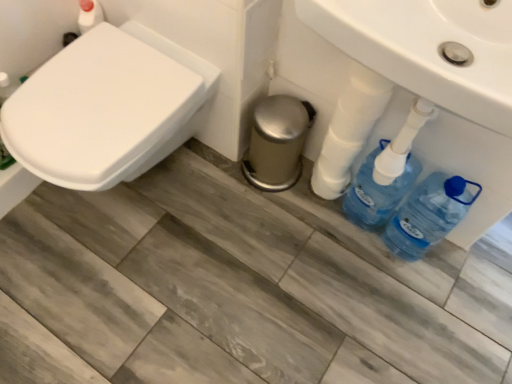
Where is `blue plastic bottle at lower right`? The height and width of the screenshot is (384, 512). blue plastic bottle at lower right is located at coordinates (428, 215).

Identify the location of white glossy sink at center. The width and height of the screenshot is (512, 384). (428, 49).

You are a GUI agent. You are given a task and a screenshot of the screen. Output one action in this format:
    pyautogui.click(x=<x>, y=<y>)
    Task: Click on the blue plastic bottle at lower right
    The height and width of the screenshot is (384, 512).
    Given the screenshot: What is the action you would take?
    pyautogui.click(x=428, y=215)

Are blue plastic bottle at lower right and white glossy toilet at left far apart?

They are positioned close to each other.

Is point (422, 220) closer or farther from the camera than point (77, 155)?

Point (422, 220) appears to be farther away from the viewer than point (77, 155).

Is white glossy toilet at left completely or partially inside blue plastic bottle at lower right?

No, white glossy toilet at left is not inside blue plastic bottle at lower right.

Can you tell me how much blue plastic bottle at lower right and white glossy toilet at left differ in facing direction?

The angle between the facing direction of blue plastic bottle at lower right and the facing direction of white glossy toilet at left is 1.95 degrees.

From the image's perspective, is blue plastic bottles at lower right below blue plastic bottle at lower right?

Incorrect, from the image's perspective, blue plastic bottles at lower right is higher than blue plastic bottle at lower right.

Is blue plastic bottle at lower right at the back of blue plastic bottles at lower right?

That's not correct — blue plastic bottles at lower right is not looking away from blue plastic bottle at lower right.

Which is closer, (361, 211) or (423, 244)?

Positioned in front is point (423, 244).

Can you confirm if blue plastic bottles at lower right is shorter than blue plastic bottle at lower right?

Incorrect, the height of blue plastic bottles at lower right does not fall short of that of blue plastic bottle at lower right.

How much distance is there between white glossy toilet at left and white glossy sink at center?

white glossy toilet at left is 23.96 inches from white glossy sink at center.

You are a GUI agent. You are given a task and a screenshot of the screen. Output one action in this format:
    pyautogui.click(x=<x>, y=<y>)
    Task: Click on the sink in front of the white glossy toilet at left
    The height and width of the screenshot is (384, 512).
    Given the screenshot: What is the action you would take?
    pyautogui.click(x=428, y=49)

Is white glossy toilet at left behind white glossy sink at center?

Yes, the depth of white glossy toilet at left is greater than that of white glossy sink at center.

Does white glossy toilet at left appear on the right side of white glossy sink at center?

In fact, white glossy toilet at left is to the left of white glossy sink at center.

Can you tell me how much blue plastic bottle at lower right and blue plastic bottles at lower right differ in facing direction?

blue plastic bottle at lower right and blue plastic bottles at lower right are facing 0.13 degrees away from each other.

Looking at this image, is blue plastic bottle at lower right oriented towards blue plastic bottles at lower right?

No.

Considering the sizes of blue plastic bottle at lower right and blue plastic bottles at lower right in the image, is blue plastic bottle at lower right wider or thinner than blue plastic bottles at lower right?

Clearly, blue plastic bottle at lower right has more width compared to blue plastic bottles at lower right.

Looking at this image, considering the sizes of objects blue plastic bottle at lower right and blue plastic bottles at lower right in the image provided, who is shorter, blue plastic bottle at lower right or blue plastic bottles at lower right?

blue plastic bottle at lower right is shorter.

Who is bigger, blue plastic bottles at lower right or white glossy toilet at left?

Bigger between the two is white glossy toilet at left.

Is blue plastic bottles at lower right further to camera compared to white glossy toilet at left?

Yes, blue plastic bottles at lower right is further from the viewer.

Is point (377, 217) in front of point (12, 125)?

No, (377, 217) is behind (12, 125).

Does blue plastic bottles at lower right touch white glossy toilet at left?

blue plastic bottles at lower right and white glossy toilet at left are clearly separated.

Are blue plastic bottle at lower right and white glossy sink at center beside each other?

blue plastic bottle at lower right and white glossy sink at center are not in contact.

Which point is more forward, (431, 232) or (432, 27)?

The point (432, 27) is closer.

From a real-world perspective, is blue plastic bottle at lower right located higher than white glossy sink at center?

No, from a real-world perspective, blue plastic bottle at lower right is not on top of white glossy sink at center.

Considering the positions of objects blue plastic bottle at lower right and white glossy sink at center in the image provided, who is more to the left, blue plastic bottle at lower right or white glossy sink at center?

Positioned to the left is white glossy sink at center.

Is white glossy toilet at left oriented away from blue plastic bottle at lower right?

white glossy toilet at left does not have its back to blue plastic bottle at lower right.

From a real-world perspective, which is physically above, white glossy toilet at left or blue plastic bottle at lower right?

From a 3D spatial view, white glossy toilet at left is above.

Is the surface of white glossy toilet at left in direct contact with blue plastic bottle at lower right?

No, white glossy toilet at left is not in contact with blue plastic bottle at lower right.

The image size is (512, 384). I want to click on bottle behind the white glossy toilet at left, so click(x=428, y=215).

I want to click on bottle above the blue plastic bottles at lower right (from a real-world perspective), so click(x=428, y=215).

Looking at the image, which one is located further to white glossy toilet at left, white glossy sink at center or blue plastic bottles at lower right?

blue plastic bottles at lower right is further to white glossy toilet at left.

When comparing their distances from blue plastic bottles at lower right, does white glossy toilet at left or white glossy sink at center seem closer?

white glossy sink at center lies closer to blue plastic bottles at lower right than the other object.

Estimate the real-world distances between objects in this image. Which object is closer to white glossy sink at center, blue plastic bottles at lower right or blue plastic bottle at lower right?

Based on the image, blue plastic bottles at lower right appears to be nearer to white glossy sink at center.

Based on their spatial positions, is blue plastic bottles at lower right or blue plastic bottle at lower right further from white glossy toilet at left?

blue plastic bottle at lower right is positioned further to the anchor white glossy toilet at left.

When comparing their distances from blue plastic bottle at lower right, does blue plastic bottles at lower right or white glossy sink at center seem closer?

blue plastic bottles at lower right lies closer to blue plastic bottle at lower right than the other object.

Which object lies further to the anchor point blue plastic bottles at lower right, blue plastic bottle at lower right or white glossy toilet at left?

white glossy toilet at left.

Based on the photo, considering their positions, is blue plastic bottle at lower right positioned closer to white glossy sink at center than white glossy toilet at left?

blue plastic bottle at lower right is closer to white glossy sink at center.

Based on their spatial positions, is white glossy sink at center or blue plastic bottles at lower right closer to blue plastic bottle at lower right?

blue plastic bottles at lower right is closer to blue plastic bottle at lower right.

This screenshot has height=384, width=512. I want to click on sink between white glossy toilet at left and blue plastic bottles at lower right, so click(x=428, y=49).

Image resolution: width=512 pixels, height=384 pixels. What are the coordinates of `bottle between white glossy sink at center and blue plastic bottles at lower right along the z-axis` in the screenshot? It's located at (428, 215).

Identify the location of sink between white glossy toilet at left and blue plastic bottle at lower right in the horizontal direction. The image size is (512, 384). (428, 49).

Image resolution: width=512 pixels, height=384 pixels. In order to click on cleaning product between white glossy toilet at left and blue plastic bottle at lower right in this screenshot , I will do click(386, 173).